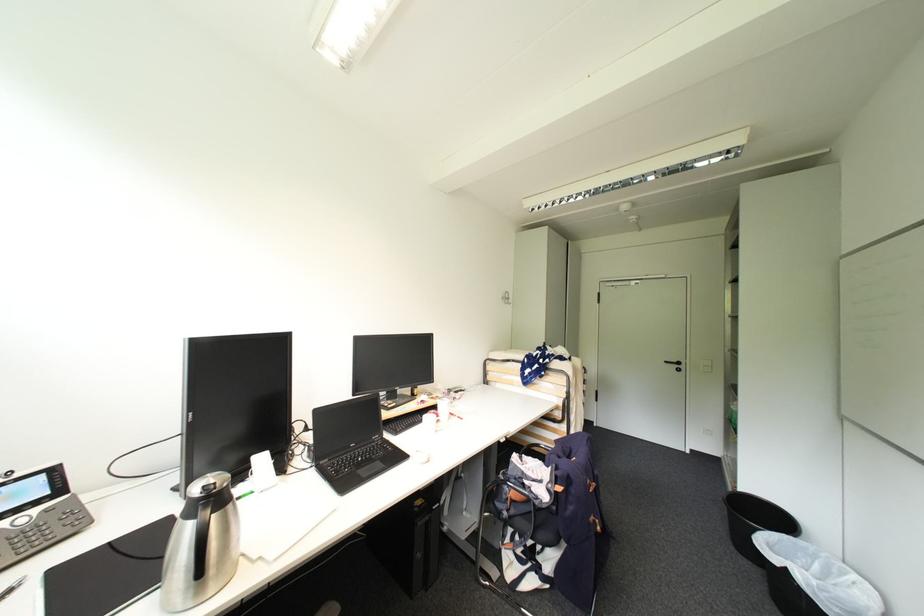
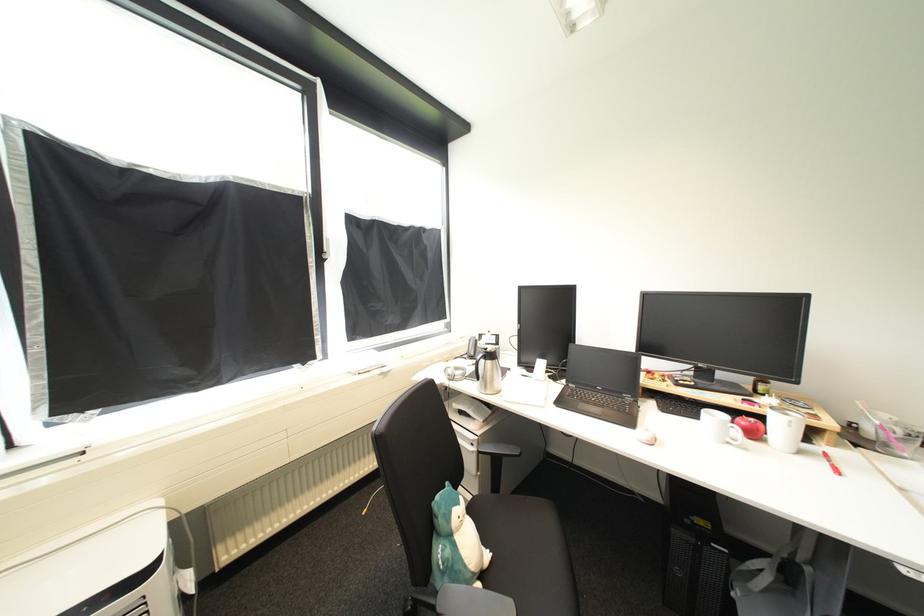
The point at (453, 524) is marked in the first image. Where is the corresponding point in the second image?

(745, 591)